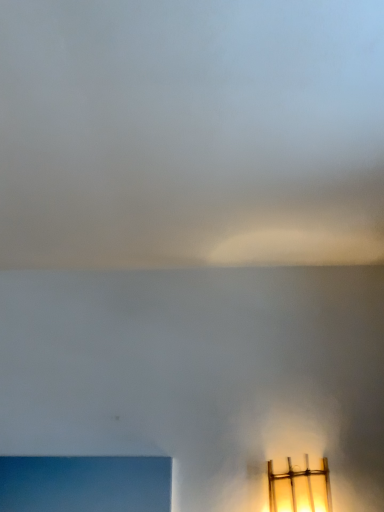
Locate an element on the screen. translucent glass lamp at lower right is located at coordinates (300, 488).

What is the approximate height of translucent glass lamp at lower right?

translucent glass lamp at lower right is 6.78 inches tall.

The height and width of the screenshot is (512, 384). Describe the element at coordinates (300, 488) in the screenshot. I see `translucent glass lamp at lower right` at that location.

Identify the location of translucent glass lamp at lower right. This screenshot has height=512, width=384. (300, 488).